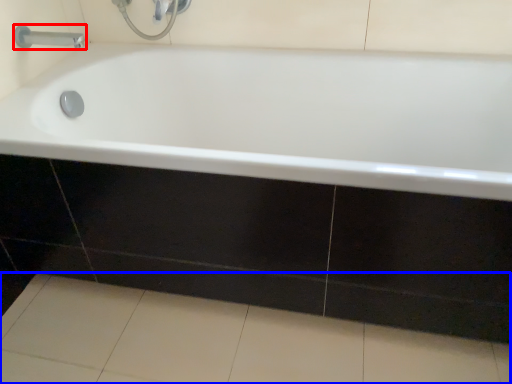
Question: Which point is closer to the camera, tap (highlighted by a red box) or ceramic tile (highlighted by a blue box)?

Choices:
 (A) tap
 (B) ceramic tile

Answer: (B)